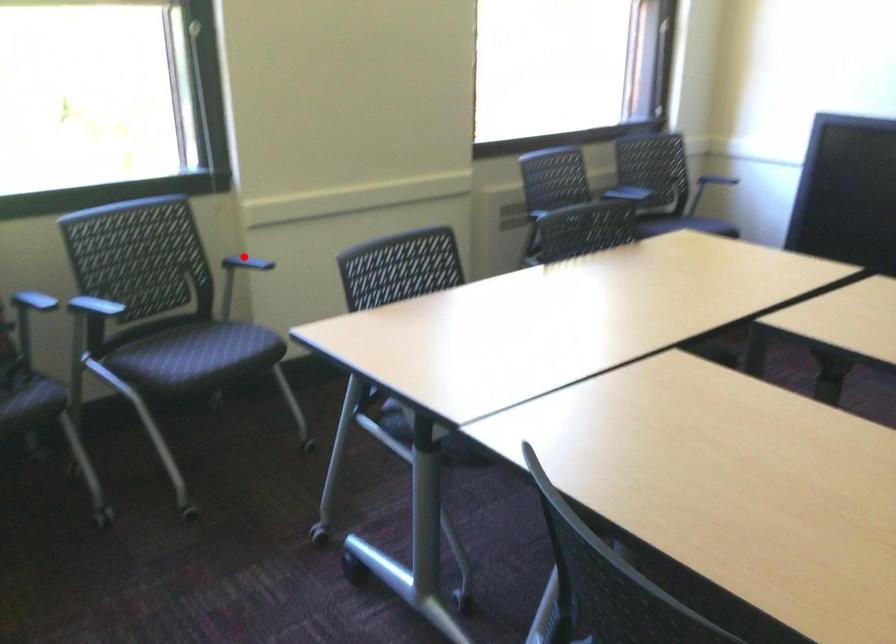
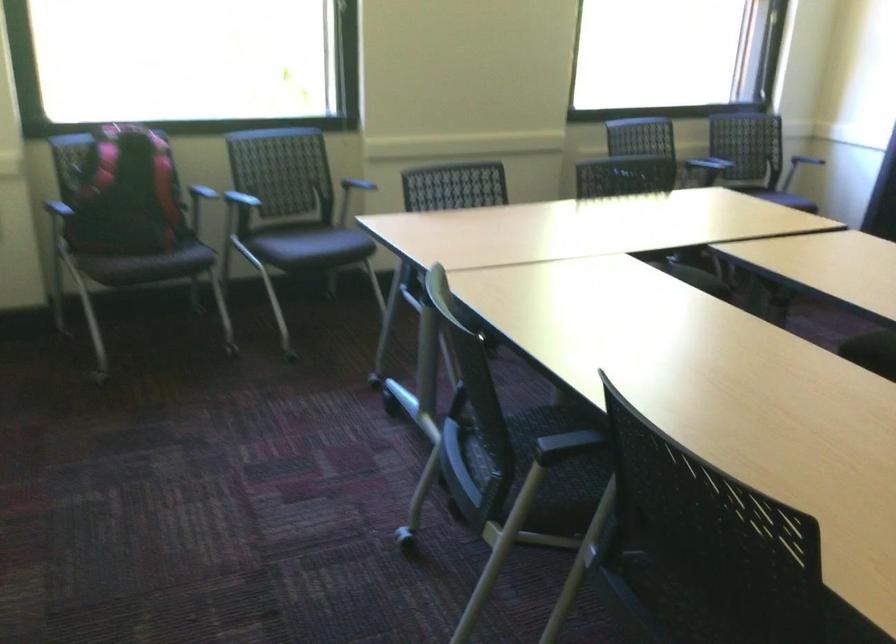
Where in the second image is the point corresponding to the highlighted location from the first image?

(362, 176)